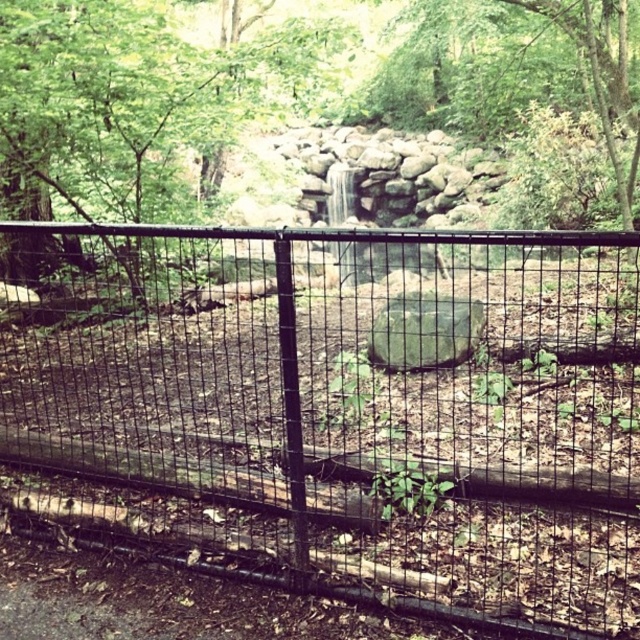
Question: Among these points, which one is nearest to the camera?

Choices:
 (A) pos(605,467)
 (B) pos(458,330)

Answer: (A)

Question: Which point is closer to the camera?

Choices:
 (A) green mossy rock at center
 (B) green leafy tree at center
 (C) green leafy tree at upper center

Answer: (A)

Question: Is black wire mesh fence at center to the right of green leafy tree at center from the viewer's perspective?

Choices:
 (A) no
 (B) yes

Answer: (B)

Question: Which object is closer to the camera taking this photo?

Choices:
 (A) green leafy tree at center
 (B) green mossy rock at center
 (C) green leafy tree at upper center

Answer: (B)

Question: Can you confirm if black wire mesh fence at center is thinner than green mossy rock at center?

Choices:
 (A) no
 (B) yes

Answer: (A)

Question: Where is black wire mesh fence at center located in relation to green leafy tree at center in the image?

Choices:
 (A) above
 (B) below

Answer: (B)